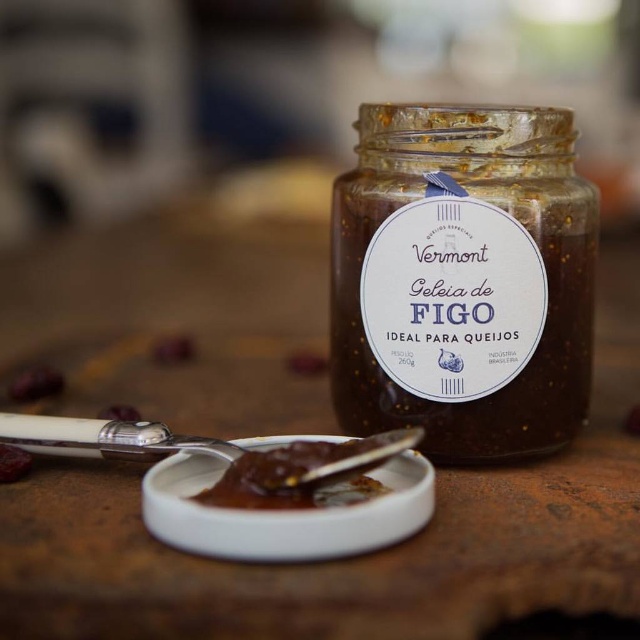
Is the position of white ceramic spoon at lower center less distant than that of brown matte fig jam at center?

Yes, it is in front of brown matte fig jam at center.

Looking at this image, between white ceramic spoon at lower center and brown matte fig jam at center, which one appears on the left side from the viewer's perspective?

Positioned to the left is brown matte fig jam at center.

Who is more forward, (156, 428) or (28, 381)?

Point (156, 428) is in front.

I want to click on white ceramic spoon at lower center, so click(x=106, y=438).

Does brown gelatinous substance at center have a smaller size compared to brown matte fig jam at center?

Incorrect, brown gelatinous substance at center is not smaller in size than brown matte fig jam at center.

Does brown gelatinous substance at center appear on the left side of brown matte fig jam at center?

Incorrect, brown gelatinous substance at center is not on the left side of brown matte fig jam at center.

Image resolution: width=640 pixels, height=640 pixels. Describe the element at coordinates (291, 477) in the screenshot. I see `brown gelatinous substance at center` at that location.

Identify the location of brown gelatinous substance at center. The image size is (640, 640). (291, 477).

Is transparent glass jar at center closer to the viewer compared to brown matte fig jam at center?

Yes.

The height and width of the screenshot is (640, 640). I want to click on transparent glass jar at center, so click(x=464, y=280).

The image size is (640, 640). What do you see at coordinates (464, 280) in the screenshot?
I see `transparent glass jar at center` at bounding box center [464, 280].

You are a GUI agent. You are given a task and a screenshot of the screen. Output one action in this format:
    pyautogui.click(x=<x>, y=<y>)
    Task: Click on the transparent glass jar at center
    
    Given the screenshot: What is the action you would take?
    pyautogui.click(x=464, y=280)